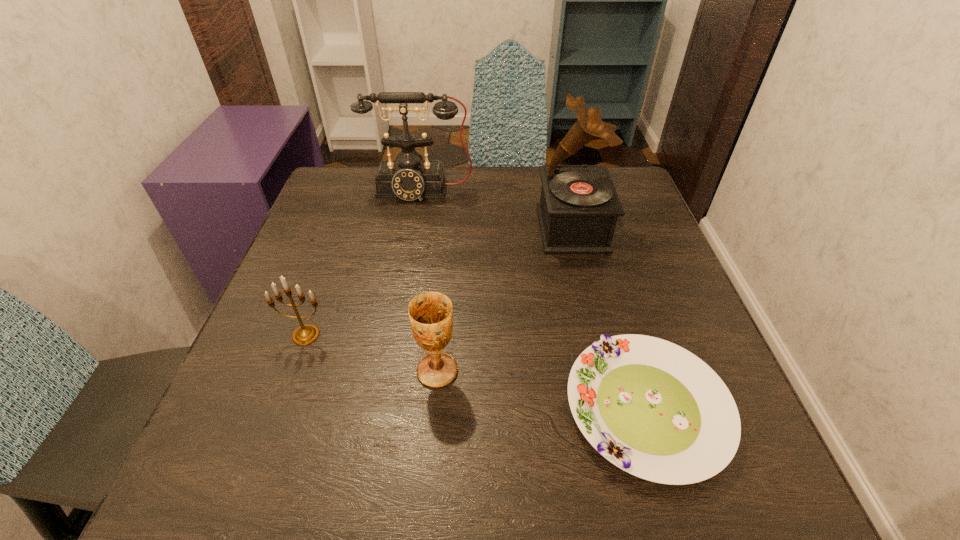
You are a GUI agent. You are given a task and a screenshot of the screen. Output one action in this format:
    pyautogui.click(x=<x>, y=<y>)
    Task: Click on the phonograph_record
    
    Given the screenshot: What is the action you would take?
    pyautogui.click(x=579, y=206)

The image size is (960, 540). Identify the location of the fourth nearest object. (579, 206).

Image resolution: width=960 pixels, height=540 pixels. What are the coordinates of `the fourth shortest object` in the screenshot? It's located at (x=409, y=177).

Find the location of a particular element. telephone is located at coordinates (409, 177).

Identify the location of chalice. (431, 317).

The height and width of the screenshot is (540, 960). I want to click on candelabrum, so click(306, 334).

Where is `the shortest object`? the shortest object is located at coordinates (652, 408).

The width and height of the screenshot is (960, 540). Identify the location of free space located 0.240m at the horn opening of the fourth nearest object. (437, 228).

The width and height of the screenshot is (960, 540). I want to click on vacant area situated at the horn opening of the fourth nearest object, so tap(470, 228).

Locate an element on the screen. Image resolution: width=960 pixels, height=540 pixels. free space located at the horn opening of the fourth nearest object is located at coordinates (411, 228).